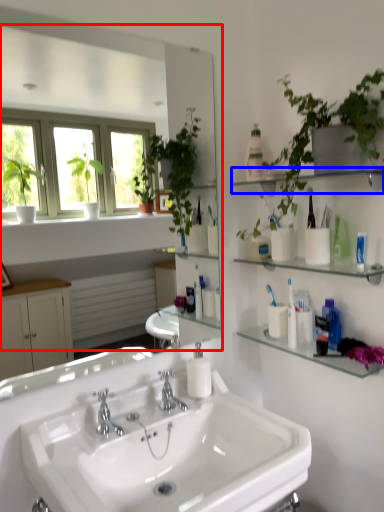
Question: Which object appears closest to the camera in this image, mirror (highlighted by a red box) or shelf (highlighted by a blue box)?

Choices:
 (A) mirror
 (B) shelf

Answer: (A)